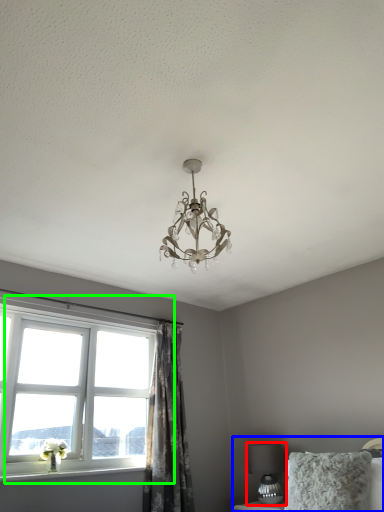
Question: Which object is positioned closest to table lamp (highlighted by a red box)? Select from bed (highlighted by a blue box) and window (highlighted by a green box).

Choices:
 (A) bed
 (B) window

Answer: (A)